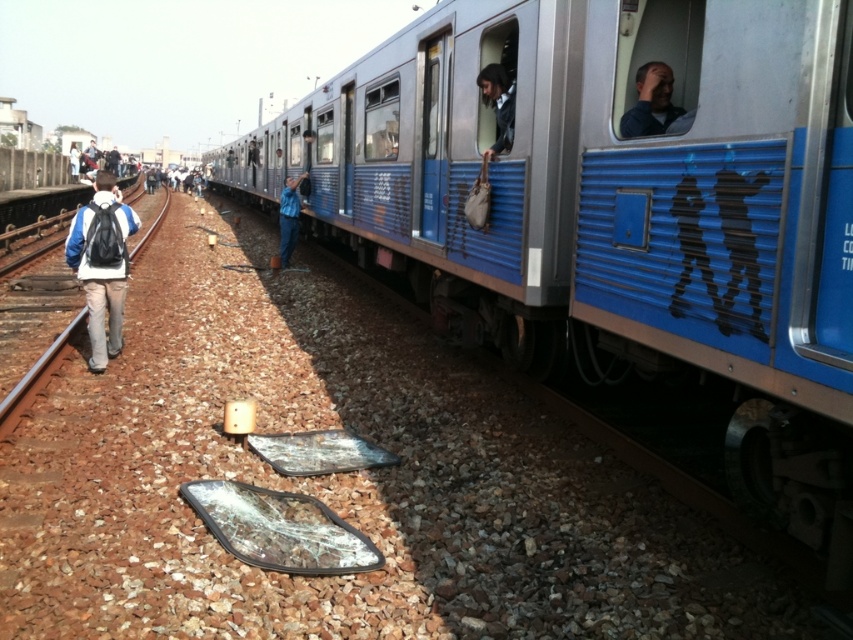
Measure the distance between point (x=444, y=196) and camera.

A distance of 20.38 feet exists between point (x=444, y=196) and camera.

Where is `metallic blue train at center`? This screenshot has height=640, width=853. metallic blue train at center is located at coordinates (614, 209).

You are a GUI agent. You are given a task and a screenshot of the screen. Output one action in this format:
    pyautogui.click(x=<x>, y=<y>)
    Task: Click on the metallic blue train at center
    Image resolution: width=853 pixels, height=640 pixels.
    Given the screenshot: What is the action you would take?
    pyautogui.click(x=614, y=209)

Who is more distant from viewer, (489, 29) or (51, 352)?

The point (51, 352) is more distant.

Which is more to the right, metallic blue train at center or brown gravel train track at left?

Positioned to the right is metallic blue train at center.

The height and width of the screenshot is (640, 853). What do you see at coordinates (614, 209) in the screenshot?
I see `metallic blue train at center` at bounding box center [614, 209].

This screenshot has height=640, width=853. What are the coordinates of `metallic blue train at center` in the screenshot? It's located at (614, 209).

Between metallic blue train at center and blue fabric backpack at left, which one appears on the left side from the viewer's perspective?

blue fabric backpack at left

Is metallic blue train at center to the right of blue fabric backpack at left from the viewer's perspective?

Correct, you'll find metallic blue train at center to the right of blue fabric backpack at left.

Does point (729, 312) come in front of point (93, 275)?

Yes, point (729, 312) is in front of point (93, 275).

Locate an element on the screen. This screenshot has width=853, height=640. metallic blue train at center is located at coordinates (614, 209).